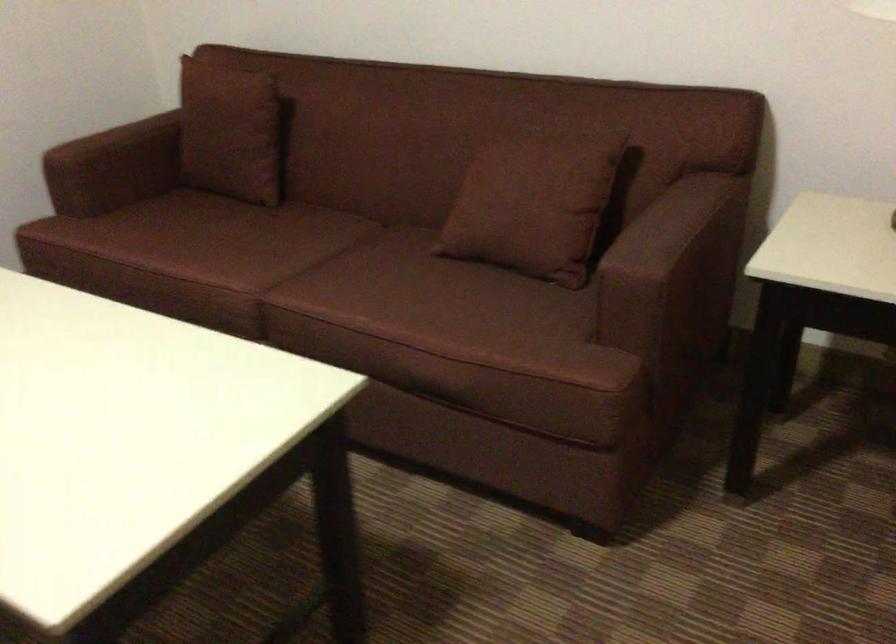
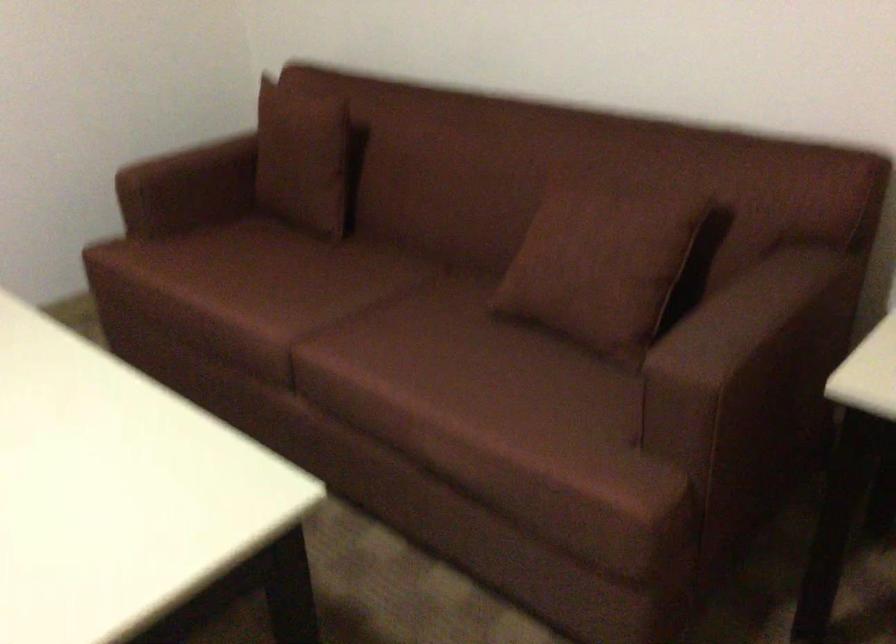
In the second image, find the point that corresponds to point 707,341 in the first image.

(791, 446)